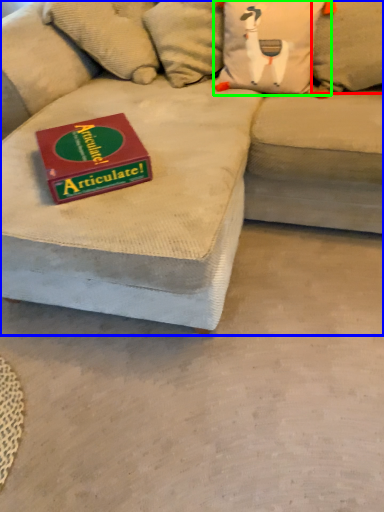
Question: Estimate the real-world distances between objects in this image. Which object is farther from pillow (highlighted by a red box), studio couch (highlighted by a blue box) or pillow (highlighted by a green box)?

Choices:
 (A) studio couch
 (B) pillow

Answer: (A)